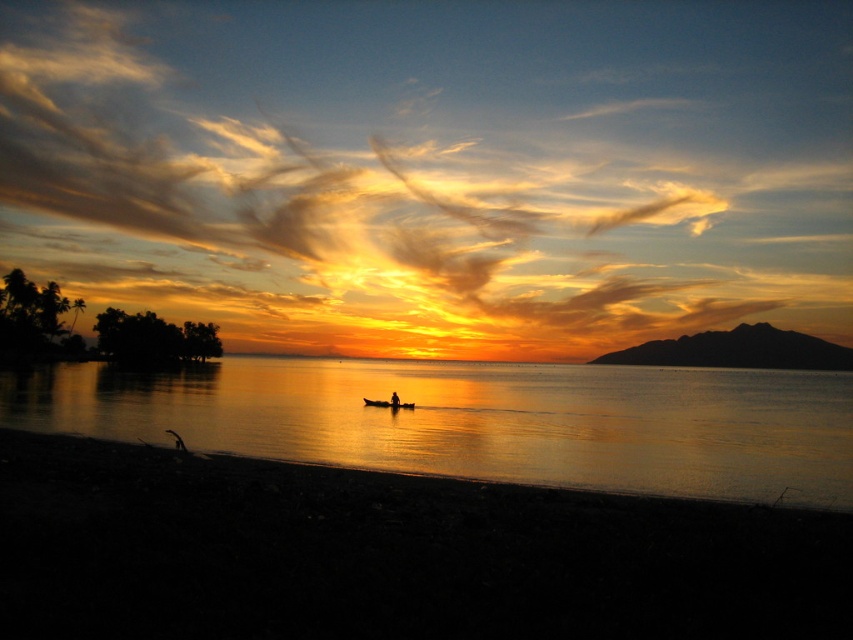
Which of these two, golden cotton clouds at upper center or silky smooth water at center, stands taller?

golden cotton clouds at upper center is taller.

Is golden cotton clouds at upper center below silky smooth water at center?

No, golden cotton clouds at upper center is not below silky smooth water at center.

The height and width of the screenshot is (640, 853). What do you see at coordinates (434, 168) in the screenshot? I see `golden cotton clouds at upper center` at bounding box center [434, 168].

Find the location of `golden cotton clouds at upper center`. golden cotton clouds at upper center is located at coordinates (434, 168).

Does wooden canoe at center have a lesser width compared to silhouette human at center?

No, wooden canoe at center is not thinner than silhouette human at center.

This screenshot has width=853, height=640. Describe the element at coordinates (387, 403) in the screenshot. I see `wooden canoe at center` at that location.

Measure the distance between point (415,403) and camera.

A distance of 43.75 meters exists between point (415,403) and camera.

I want to click on wooden canoe at center, so click(x=387, y=403).

Can you confirm if silky smooth water at center is shorter than silhouette human at center?

In fact, silky smooth water at center may be taller than silhouette human at center.

Does silky smooth water at center have a greater width compared to silhouette human at center?

Yes, silky smooth water at center is wider than silhouette human at center.

Image resolution: width=853 pixels, height=640 pixels. Identify the location of silky smooth water at center. (479, 420).

Where is `silky smooth water at center`? This screenshot has width=853, height=640. silky smooth water at center is located at coordinates [x=479, y=420].